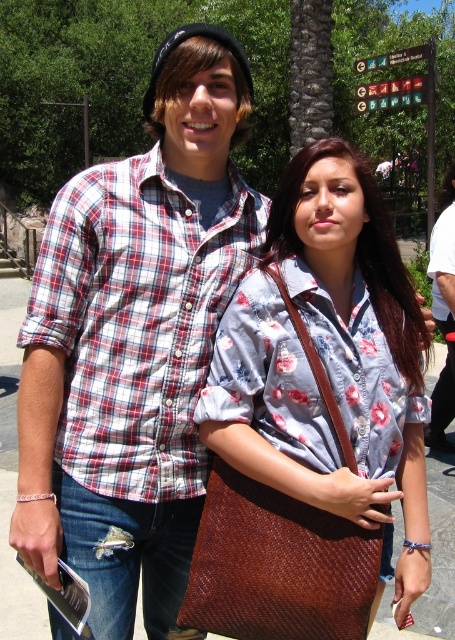
Between brown woven bag at center and plaid cotton shirt at upper left, which one has less height?

With less height is plaid cotton shirt at upper left.

Is brown woven bag at center smaller than plaid cotton shirt at upper left?

No, brown woven bag at center is not smaller than plaid cotton shirt at upper left.

Which is behind, point (340, 394) or point (82, 436)?

Positioned behind is point (82, 436).

Where is `brown woven bag at center`? This screenshot has width=455, height=640. brown woven bag at center is located at coordinates (328, 364).